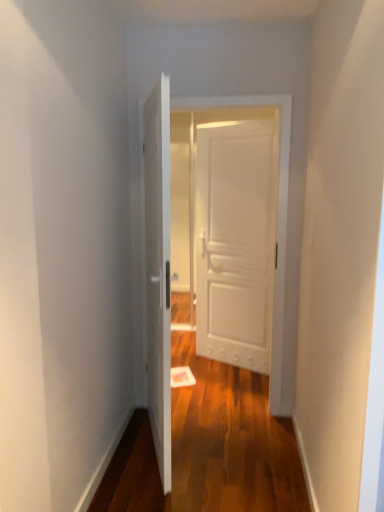
Question: Considering the relative sizes of white matte door at center, positioned as the first door in front-to-back order, and white wooden door at center, the second door from the back, in the image provided, is white matte door at center, positioned as the first door in front-to-back order, bigger than white wooden door at center, the second door from the back,?

Choices:
 (A) no
 (B) yes

Answer: (B)

Question: Considering the relative positions of white matte door at center, positioned as the first door in front-to-back order, and white wooden door at center, the second door from the back, in the image provided, is white matte door at center, positioned as the first door in front-to-back order, in front of white wooden door at center, the second door from the back,?

Choices:
 (A) yes
 (B) no

Answer: (A)

Question: Is white matte door at center, positioned as the first door in front-to-back order, touching white wooden door at center, which appears as the 2th door when viewed from the front?

Choices:
 (A) yes
 (B) no

Answer: (B)

Question: Is white matte door at center, positioned as the first door in front-to-back order, not near white wooden door at center, which appears as the 2th door when viewed from the front?

Choices:
 (A) no
 (B) yes

Answer: (A)

Question: Can you confirm if white matte door at center, which is the third door in back-to-front order, is thinner than white wooden door at center, the second door from the back?

Choices:
 (A) no
 (B) yes

Answer: (A)

Question: In the image, is white matte door at center, which is the third door in back-to-front order, on the left side or the right side of white wooden door at center, which appears as the 2th door when viewed from the front?

Choices:
 (A) left
 (B) right

Answer: (A)

Question: Is white matte door at center, which is the third door in back-to-front order, situated inside white wooden door at center, the second door from the back, or outside?

Choices:
 (A) inside
 (B) outside

Answer: (B)

Question: Considering the positions of white matte door at center, which is the third door in back-to-front order, and white wooden door at center, which appears as the 2th door when viewed from the front, in the image, is white matte door at center, which is the third door in back-to-front order, taller or shorter than white wooden door at center, which appears as the 2th door when viewed from the front,?

Choices:
 (A) short
 (B) tall

Answer: (A)

Question: Does point (157, 366) appear closer or farther from the camera than point (273, 288)?

Choices:
 (A) farther
 (B) closer

Answer: (B)

Question: From the image's perspective, relative to white wooden door at center, which appears as the 2th door when viewed from the front, is white matte door at center, which is the third door from front to back, above or below?

Choices:
 (A) below
 (B) above

Answer: (B)

Question: Considering the positions of white matte door at center, which is the third door from front to back, and white wooden door at center, the second door from the back, in the image, is white matte door at center, which is the third door from front to back, taller or shorter than white wooden door at center, the second door from the back,?

Choices:
 (A) tall
 (B) short

Answer: (B)

Question: Visually, is white matte door at center, placed as the first door when sorted from back to front, positioned to the left or to the right of white wooden door at center, which appears as the 2th door when viewed from the front?

Choices:
 (A) left
 (B) right

Answer: (B)

Question: From a real-world perspective, is white matte door at center, which is the third door from front to back, physically located above or below white wooden door at center, the second door from the back?

Choices:
 (A) above
 (B) below

Answer: (B)

Question: Relative to white matte door at center, which is the third door from front to back, is white wooden door at center, which appears as the 2th door when viewed from the front, in front or behind?

Choices:
 (A) front
 (B) behind

Answer: (A)

Question: In terms of width, does white wooden door at center, the second door from the back, look wider or thinner when compared to white matte door at center, placed as the first door when sorted from back to front?

Choices:
 (A) thin
 (B) wide

Answer: (B)